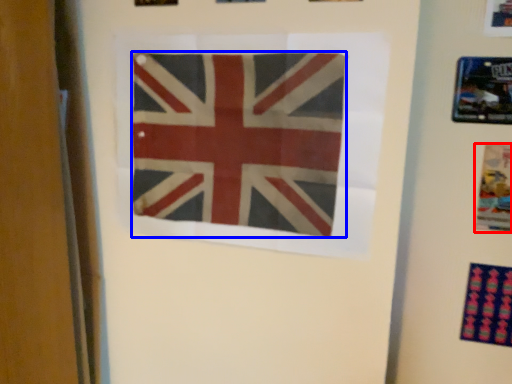
Question: Which object appears closest to the camera in this image, poster (highlighted by a red box) or flag (highlighted by a blue box)?

Choices:
 (A) poster
 (B) flag

Answer: (B)